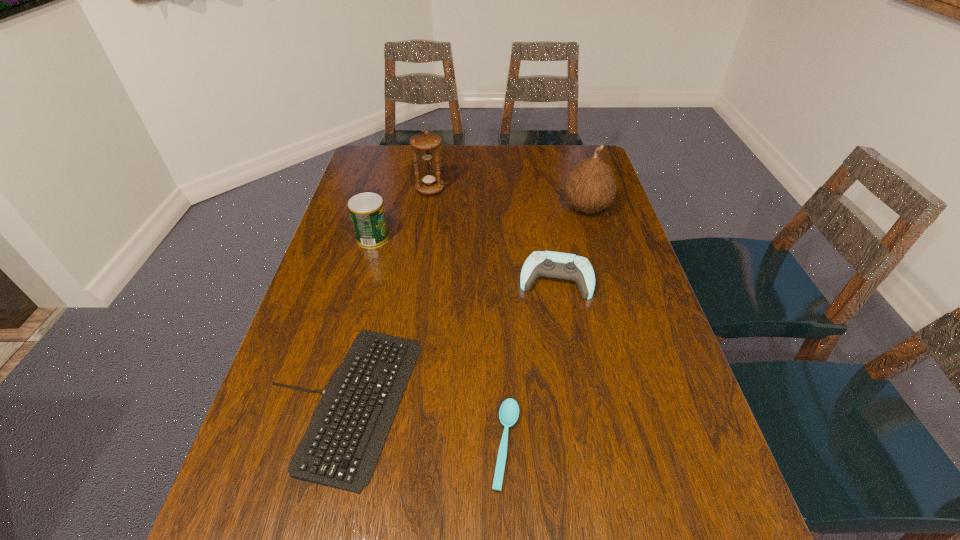
This screenshot has width=960, height=540. Find the location of `control present at the right edge`. control present at the right edge is located at coordinates (557, 265).

The width and height of the screenshot is (960, 540). Identify the location of free space at the far edge. (525, 149).

Image resolution: width=960 pixels, height=540 pixels. What are the coordinates of `vacant space at the left edge of the desktop` in the screenshot? It's located at (385, 183).

Where is `free location at the right edge`? The width and height of the screenshot is (960, 540). free location at the right edge is located at coordinates (647, 413).

Where is `free spot at the far left corner of the desktop`? The width and height of the screenshot is (960, 540). free spot at the far left corner of the desktop is located at coordinates (381, 159).

Find the location of `unoccupied area between the can and the spoon`. unoccupied area between the can and the spoon is located at coordinates (440, 341).

Where is `empty space that is in between the fifth tallest object and the third nearest object`? This screenshot has width=960, height=540. empty space that is in between the fifth tallest object and the third nearest object is located at coordinates (447, 341).

Where is `free space between the second tallest object and the shortest object`? The width and height of the screenshot is (960, 540). free space between the second tallest object and the shortest object is located at coordinates (468, 317).

Find the location of a particular element. The width and height of the screenshot is (960, 540). vacant space that's between the hourglass and the tallest object is located at coordinates (508, 199).

I want to click on vacant region between the fifth shortest object and the shortest object, so click(468, 317).